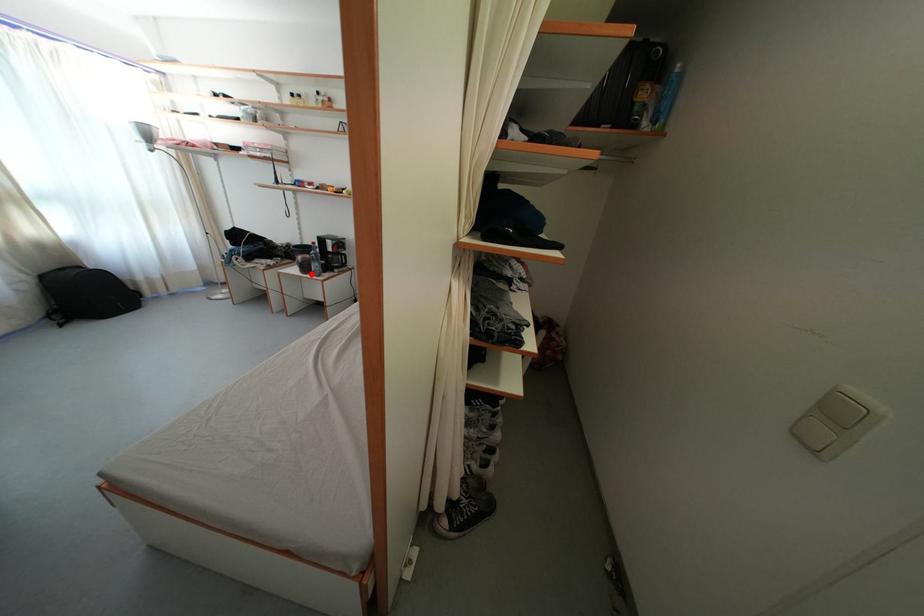
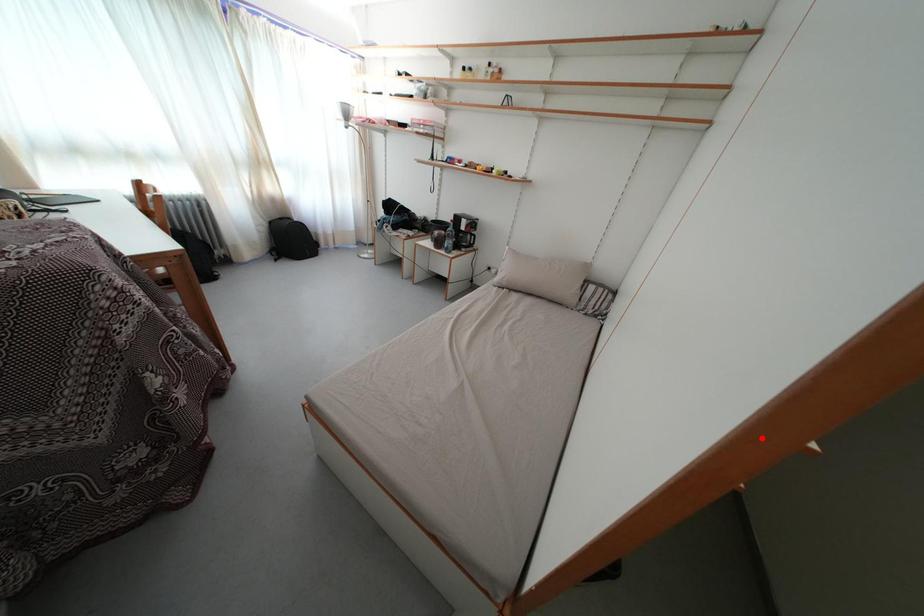
I am providing you with two images of the same scene from different viewpoints. A red point is marked on the first image and another point is marked on the second image. Are the points marked in image1 and image2 representing the same 3D position?

No